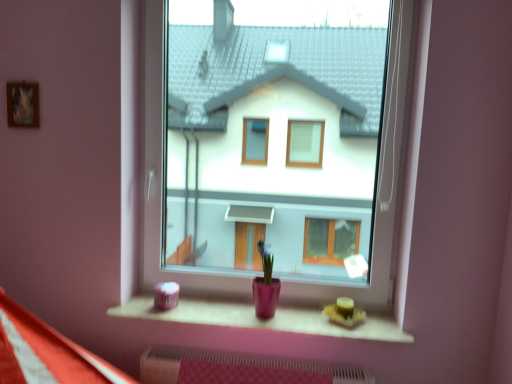
Question: Should I look upward or downward to see transparent glass window at center?

Choices:
 (A) down
 (B) up

Answer: (B)

Question: From a real-world perspective, is matte pink wood at lower center below wooden frame at upper left?

Choices:
 (A) no
 (B) yes

Answer: (B)

Question: Does matte pink wood at lower center have a greater height compared to wooden frame at upper left?

Choices:
 (A) no
 (B) yes

Answer: (A)

Question: From the image's perspective, is matte pink wood at lower center below wooden frame at upper left?

Choices:
 (A) yes
 (B) no

Answer: (A)

Question: Is matte pink wood at lower center completely or partially outside of wooden frame at upper left?

Choices:
 (A) no
 (B) yes

Answer: (B)

Question: From the image's perspective, is matte pink wood at lower center above wooden frame at upper left?

Choices:
 (A) no
 (B) yes

Answer: (A)

Question: Is matte pink wood at lower center far from wooden frame at upper left?

Choices:
 (A) yes
 (B) no

Answer: (A)

Question: Considering the relative positions of wooden frame at upper left and matte pink wood at lower center in the image provided, is wooden frame at upper left in front of matte pink wood at lower center?

Choices:
 (A) yes
 (B) no

Answer: (B)

Question: Is wooden frame at upper left positioned behind matte pink wood at lower center?

Choices:
 (A) no
 (B) yes

Answer: (B)

Question: Does wooden frame at upper left have a greater height compared to matte pink wood at lower center?

Choices:
 (A) yes
 (B) no

Answer: (A)

Question: From the image's perspective, is wooden frame at upper left below matte pink wood at lower center?

Choices:
 (A) no
 (B) yes

Answer: (A)

Question: Would you say matte pink wood at lower center is part of wooden frame at upper left's contents?

Choices:
 (A) no
 (B) yes

Answer: (A)

Question: From a real-world perspective, is wooden frame at upper left positioned under matte pink wood at lower center based on gravity?

Choices:
 (A) yes
 (B) no

Answer: (B)

Question: Does transparent glass window at center have a smaller size compared to wooden frame at upper left?

Choices:
 (A) yes
 (B) no

Answer: (B)